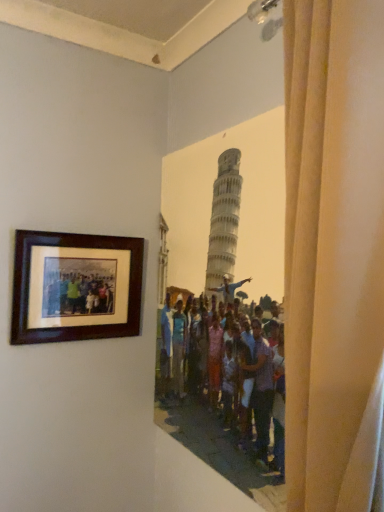
This screenshot has height=512, width=384. What do you see at coordinates (334, 253) in the screenshot?
I see `beige fabric curtain at right` at bounding box center [334, 253].

Find the location of `beige fabric curtain at right`. beige fabric curtain at right is located at coordinates (334, 253).

This screenshot has width=384, height=512. Describe the element at coordinates (76, 288) in the screenshot. I see `brown wooden picture frame at upper left` at that location.

Where is `brown wooden picture frame at upper left`? Image resolution: width=384 pixels, height=512 pixels. brown wooden picture frame at upper left is located at coordinates (76, 288).

You are a GUI agent. You are given a task and a screenshot of the screen. Output one action in this format:
    pyautogui.click(x=<x>, y=<y>)
    Task: Click on the beige fabric curtain at right
    Image resolution: width=384 pixels, height=512 pixels.
    Given the screenshot: What is the action you would take?
    pyautogui.click(x=334, y=253)

Which object is positioned more to the right, brown wooden picture frame at upper left or beige fabric curtain at right?

beige fabric curtain at right is more to the right.

In the image, is brown wooden picture frame at upper left positioned in front of or behind beige fabric curtain at right?

brown wooden picture frame at upper left is positioned farther from the viewer than beige fabric curtain at right.

Does point (45, 319) come closer to viewer compared to point (324, 477)?

No.

From the image's perspective, is brown wooden picture frame at upper left located above or below beige fabric curtain at right?

brown wooden picture frame at upper left is situated lower than beige fabric curtain at right in the image.

From a real-world perspective, which is physically below, brown wooden picture frame at upper left or beige fabric curtain at right?

brown wooden picture frame at upper left.

Is brown wooden picture frame at upper left thinner than beige fabric curtain at right?

Yes, brown wooden picture frame at upper left is thinner than beige fabric curtain at right.

Considering the relative sizes of brown wooden picture frame at upper left and beige fabric curtain at right in the image provided, is brown wooden picture frame at upper left shorter than beige fabric curtain at right?

Yes.

Does brown wooden picture frame at upper left have a smaller size compared to beige fabric curtain at right?

Yes.

Is brown wooden picture frame at upper left situated inside beige fabric curtain at right or outside?

The correct answer is: outside.

Would you say brown wooden picture frame at upper left is a long distance from beige fabric curtain at right?

No, there isn't a large distance between brown wooden picture frame at upper left and beige fabric curtain at right.

Is brown wooden picture frame at upper left positioned with its back to beige fabric curtain at right?

brown wooden picture frame at upper left does not have its back to beige fabric curtain at right.

Find the location of a particular element. Image resolution: width=384 pixels, height=512 pixels. curtain lying in front of the brown wooden picture frame at upper left is located at coordinates (334, 253).

Is beige fabric curtain at right to the left of brown wooden picture frame at upper left from the viewer's perspective?

No.

Is beige fabric curtain at right positioned behind brown wooden picture frame at upper left?

No, the depth of beige fabric curtain at right is less than that of brown wooden picture frame at upper left.

Is point (289, 318) closer or farther from the camera than point (92, 291)?

Point (289, 318) appears to be closer to the viewer than point (92, 291).

From the image's perspective, is beige fabric curtain at right located above brown wooden picture frame at upper left?

Yes, from the image's perspective, beige fabric curtain at right is on top of brown wooden picture frame at upper left.

From a real-world perspective, is beige fabric curtain at right on top of brown wooden picture frame at upper left?

Correct, in the physical world, beige fabric curtain at right is higher than brown wooden picture frame at upper left.

Is beige fabric curtain at right wider or thinner than brown wooden picture frame at upper left?

beige fabric curtain at right is wider than brown wooden picture frame at upper left.

In terms of height, does beige fabric curtain at right look taller or shorter compared to brown wooden picture frame at upper left?

In the image, beige fabric curtain at right appears to be taller than brown wooden picture frame at upper left.

In the scene shown: Does beige fabric curtain at right have a larger size compared to brown wooden picture frame at upper left?

Yes.

Would you say brown wooden picture frame at upper left is part of beige fabric curtain at right's contents?

That's incorrect, brown wooden picture frame at upper left is not inside beige fabric curtain at right.

Is beige fabric curtain at right positioned far away from brown wooden picture frame at upper left?

No, beige fabric curtain at right is in close proximity to brown wooden picture frame at upper left.

Is beige fabric curtain at right turned away from brown wooden picture frame at upper left?

No, beige fabric curtain at right's orientation is not away from brown wooden picture frame at upper left.

How different are the orientations of beige fabric curtain at right and brown wooden picture frame at upper left in degrees?

There is a 88.3-degree angle between the facing directions of beige fabric curtain at right and brown wooden picture frame at upper left.

How distant is beige fabric curtain at right from brown wooden picture frame at upper left?

34.59 inches.

Where is `curtain in front of the brown wooden picture frame at upper left`? The height and width of the screenshot is (512, 384). curtain in front of the brown wooden picture frame at upper left is located at coordinates (334, 253).

This screenshot has width=384, height=512. In order to click on picture frame on the left of beige fabric curtain at right in this screenshot , I will do `click(76, 288)`.

The width and height of the screenshot is (384, 512). In order to click on curtain on the right of the brown wooden picture frame at upper left in this screenshot , I will do `click(334, 253)`.